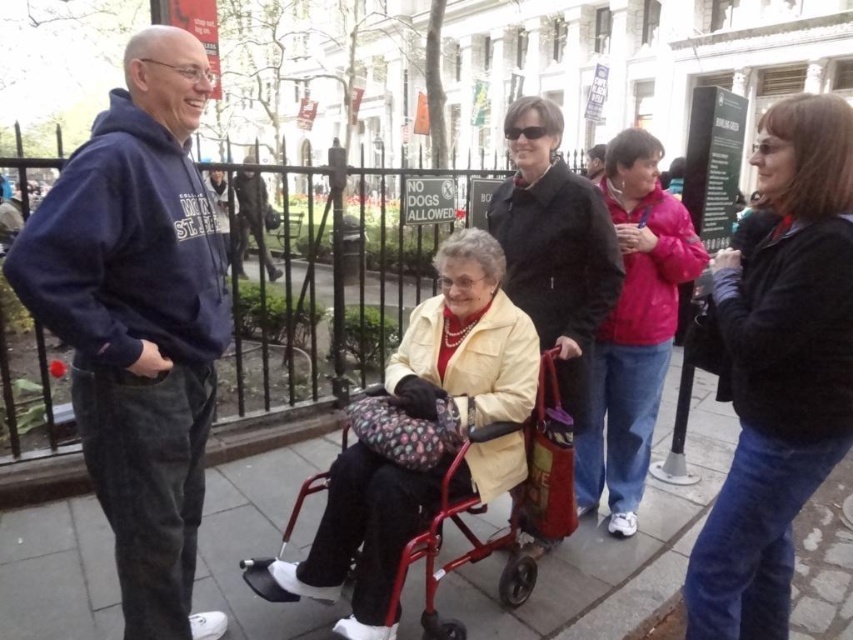
Based on the scene description, where is the smooth concrete sidewalk at center located in terms of coordinates?

The smooth concrete sidewalk at center is located at coordinates point (607, 554).

You are a delivery person trying to place a small package on the ground between the smooth concrete sidewalk at center and the matte yellow jacket at center. Can you fit the package there?

The smooth concrete sidewalk at center is not as tall as matte yellow jacket at center, so the package can be placed between them as there is vertical space available.